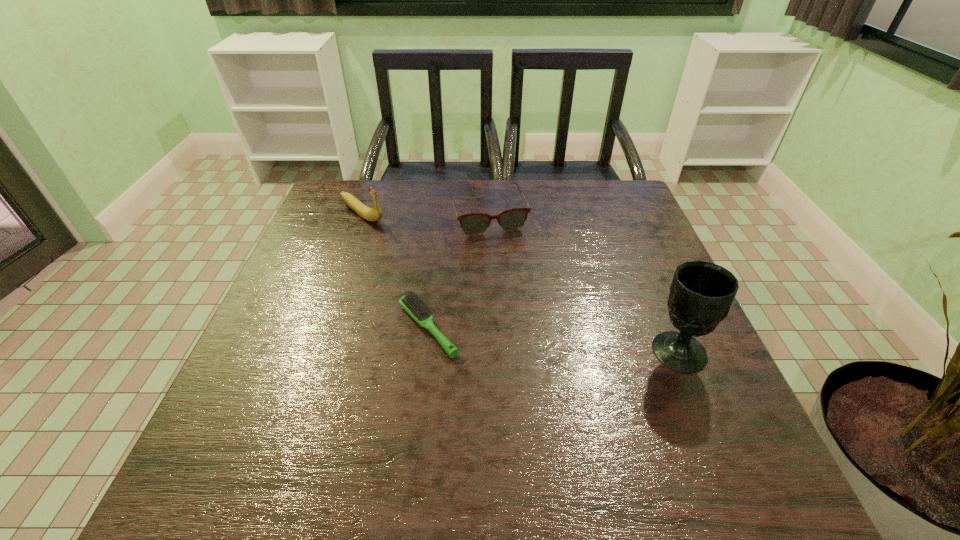
You are a GUI agent. You are given a task and a screenshot of the screen. Output one action in this format:
    pyautogui.click(x=<x>, y=<y>)
    Task: Click on the vacant space at the near edge of the desktop
    Image resolution: width=960 pixels, height=540 pixels.
    Given the screenshot: What is the action you would take?
    pyautogui.click(x=484, y=396)

Find the location of a particular element. The height and width of the screenshot is (540, 960). free space at the left edge of the desktop is located at coordinates (327, 340).

This screenshot has width=960, height=540. Identify the location of blank area at the right edge. (671, 327).

At what (x,y) coordinates should I click in order to perform the action: click on free region at the far left corner of the desktop. Please return your answer as a coordinate pair (x, y). Looking at the image, I should click on (335, 214).

Find the location of a particular element. This screenshot has height=540, width=960. vacant region at the near left corner is located at coordinates (252, 403).

In the image, there is a desktop. In order to click on vacant area at the far right corner in this screenshot , I will do `click(630, 191)`.

The height and width of the screenshot is (540, 960). I want to click on vacant space that is in between the banana and the third tallest object, so click(x=425, y=214).

Where is `vacant area that lies between the spectacles and the hairbrush`? The image size is (960, 540). vacant area that lies between the spectacles and the hairbrush is located at coordinates (458, 272).

Find the location of a particular element. Image resolution: width=960 pixels, height=540 pixels. blank region between the spectacles and the banana is located at coordinates (425, 214).

The height and width of the screenshot is (540, 960). What are the coordinates of `free space that is in between the leftmost object and the third tallest object` in the screenshot? It's located at (425, 214).